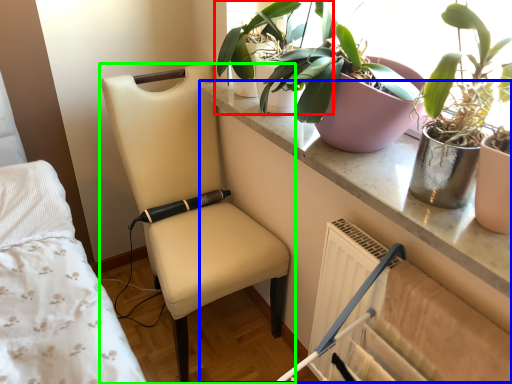
Question: Which is farther away from houseplant (highlighted by a red box)? table (highlighted by a blue box) or chair (highlighted by a green box)?

Choices:
 (A) table
 (B) chair

Answer: (B)